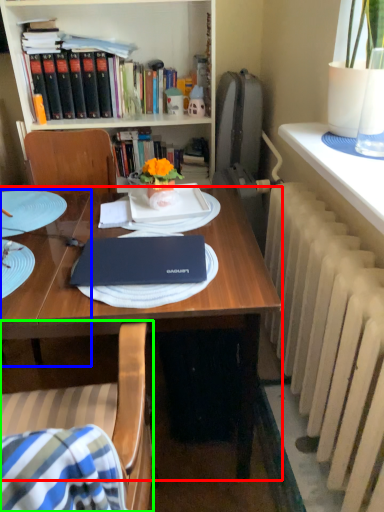
Question: Based on their relative distances, which object is nearer to desk (highlighted by a red box)? Choose from table (highlighted by a blue box) and chair (highlighted by a green box).

Choices:
 (A) table
 (B) chair

Answer: (B)